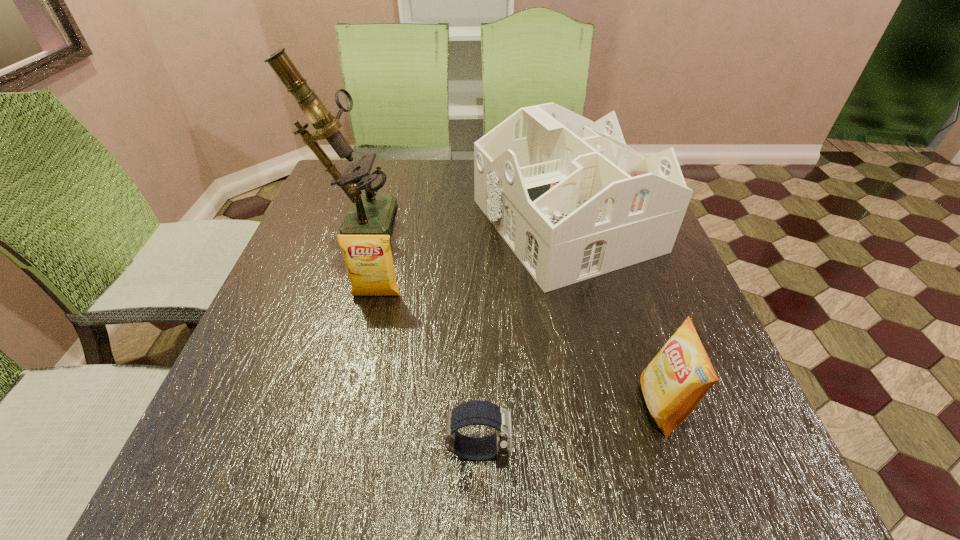
Where is `free point at the far edge`? The height and width of the screenshot is (540, 960). free point at the far edge is located at coordinates (398, 169).

In the image, there is a desktop. At what (x,y) coordinates should I click in order to perform the action: click on vacant region at the left edge. Please return your answer as a coordinate pair (x, y). Looking at the image, I should click on (324, 215).

In the image, there is a desktop. Where is `vacant space at the right edge`? This screenshot has height=540, width=960. vacant space at the right edge is located at coordinates (659, 440).

Where is `free spot at the far left corner of the desktop`? free spot at the far left corner of the desktop is located at coordinates (379, 160).

At what (x,y) coordinates should I click in order to perform the action: click on vacant area between the right crisp (potato chip) and the tallest object. Please return your answer as a coordinate pair (x, y). The image size is (960, 540). Looking at the image, I should click on (508, 310).

Locate an element on the screen. Image resolution: width=960 pixels, height=540 pixels. empty space between the farther crisp (potato chip) and the shortest object is located at coordinates (427, 373).

The image size is (960, 540). What are the coordinates of `blank region between the nearer crisp (potato chip) and the left crisp (potato chip)` in the screenshot? It's located at (519, 350).

Locate an element on the screen. unoccupied area between the right crisp (potato chip) and the fourth shortest object is located at coordinates (613, 315).

The image size is (960, 540). What are the coordinates of `free area in between the left crisp (potato chip) and the right crisp (potato chip)` in the screenshot? It's located at (519, 350).

You are a GUI agent. You are given a task and a screenshot of the screen. Output one action in this format:
    pyautogui.click(x=<x>, y=<y>)
    Task: Click on the free space that is in between the nearer crisp (potato chip) and the dollhouse
    The image size is (960, 540).
    Given the screenshot: What is the action you would take?
    pyautogui.click(x=613, y=315)